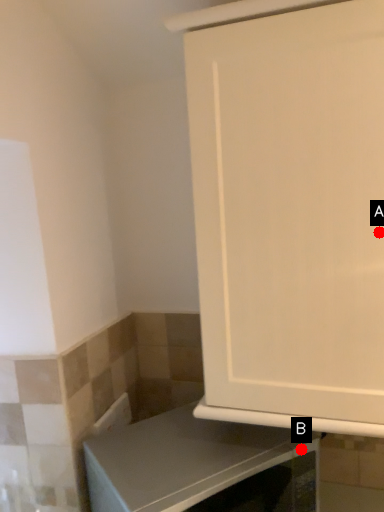
Question: Two points are circled on the image, labeled by A and B beside each circle. Which point is closer to the camera?

Choices:
 (A) A is closer
 (B) B is closer

Answer: (A)